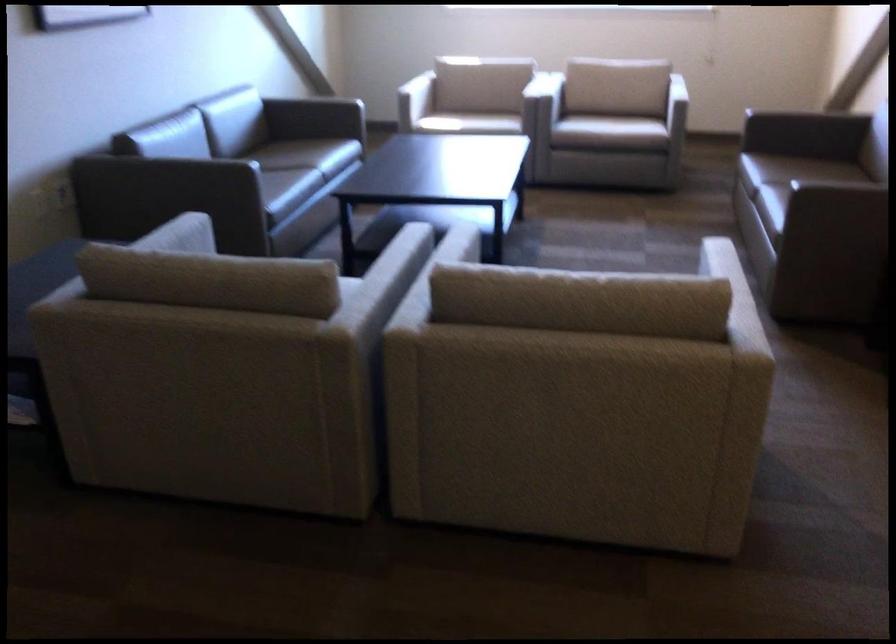
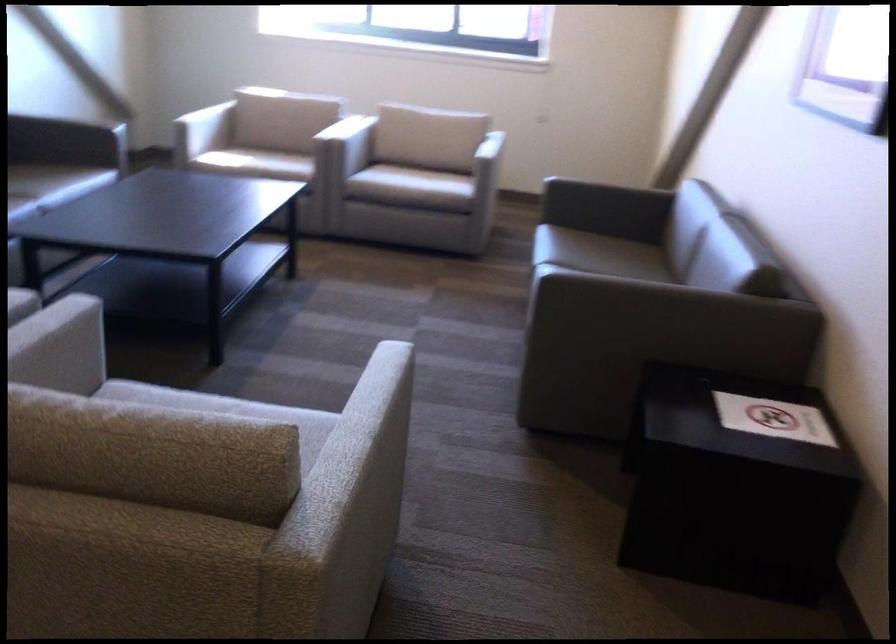
Where in the second image is the point corresponding to [561,343] from the first image?

(39, 524)